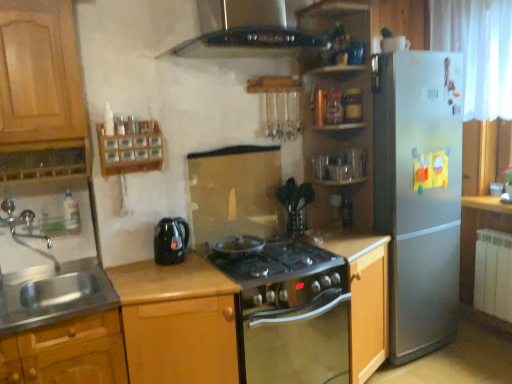
Where is `free location to the right of black glossy electric kettle at center-left`? free location to the right of black glossy electric kettle at center-left is located at coordinates (201, 264).